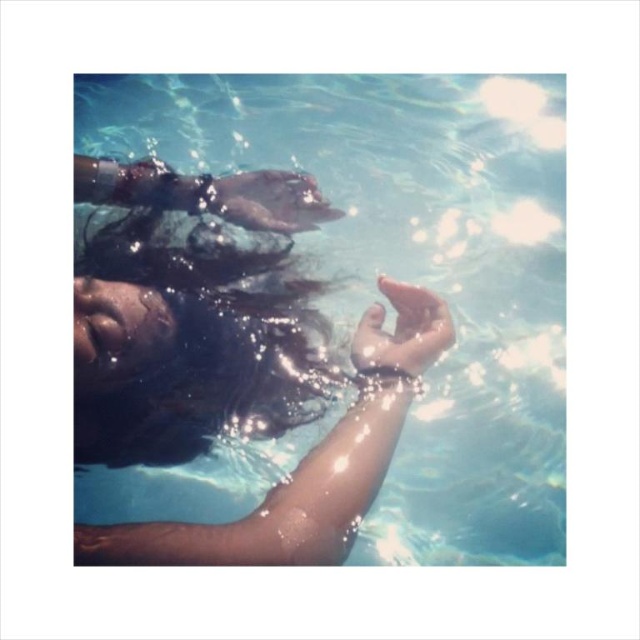
Can you confirm if clear water at center is shorter than wet dark brown hair at center?

No.

Is clear water at center closer to camera compared to wet dark brown hair at center?

No, clear water at center is behind wet dark brown hair at center.

Where is `clear water at center`? Image resolution: width=640 pixels, height=640 pixels. clear water at center is located at coordinates (332, 305).

Where is `clear water at center`? The image size is (640, 640). clear water at center is located at coordinates (332, 305).

Is translucent wet skin at center further to camera compared to smooth skin hand at center?

No, it is not.

Is point (438, 316) more distant than point (282, 189)?

No, it is in front of (282, 189).

Who is more distant from viewer, (442, 349) or (298, 214)?

The point (298, 214) is more distant.

You are a GUI agent. You are given a task and a screenshot of the screen. Output one action in this format:
    pyautogui.click(x=<x>, y=<y>)
    Task: Click on the translucent wet skin at center
    
    Given the screenshot: What is the action you would take?
    pyautogui.click(x=401, y=333)

Who is more distant from viewer, (154, 292) or (365, 349)?

The point (154, 292) is behind.

Is wet dark brown hair at center to the right of translucent wet skin at center from the viewer's perspective?

No, wet dark brown hair at center is not to the right of translucent wet skin at center.

Measure the distance between wet dark brown hair at center and camera.

They are 3.34 feet apart.

Identify the location of wet dark brown hair at center. (192, 340).